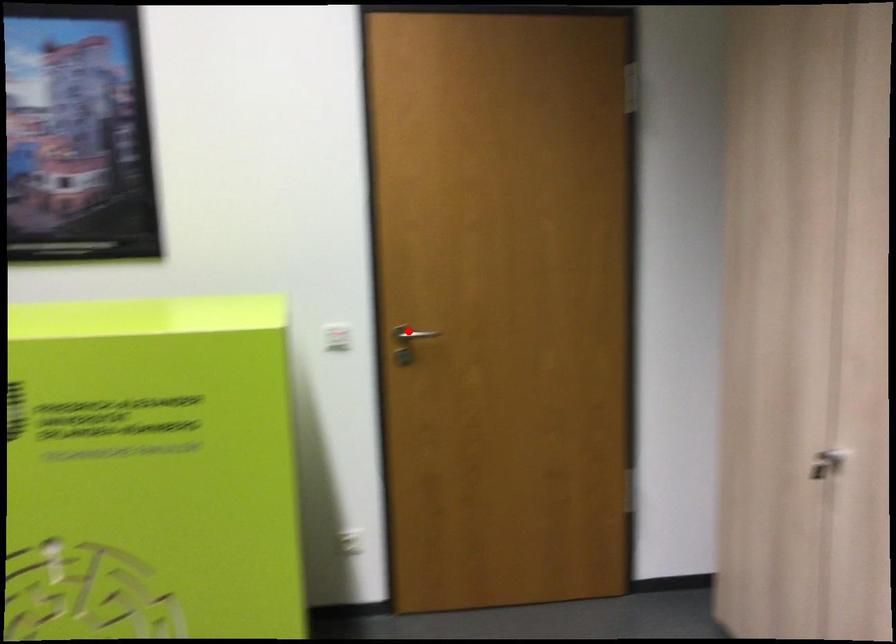
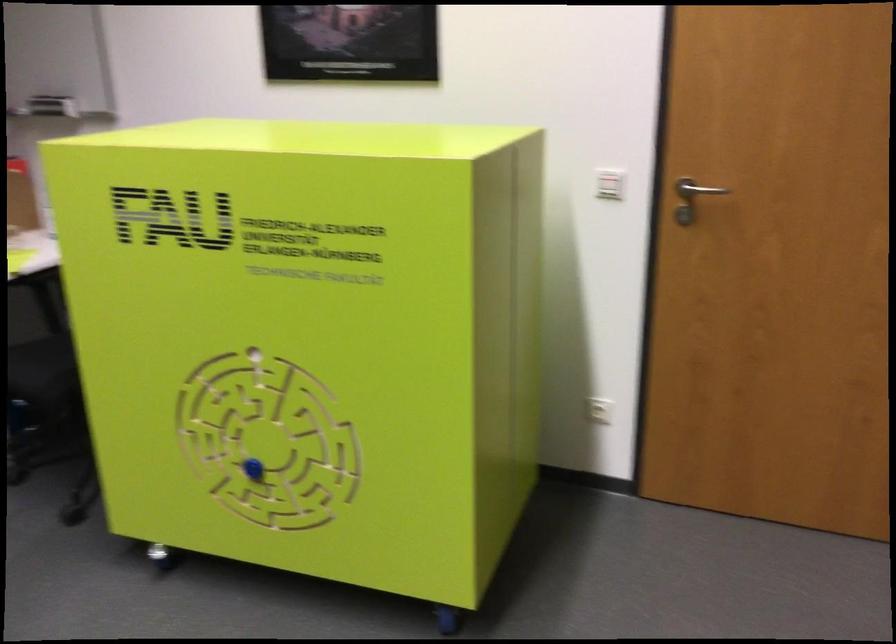
Question: I am providing you with two images of the same scene from different viewpoints. Image1 has a red point marked. In image2, the corresponding 3D location appears at what relative position? Reply with the corresponding letter.

Choices:
 (A) Closer
 (B) Farther

Answer: (A)